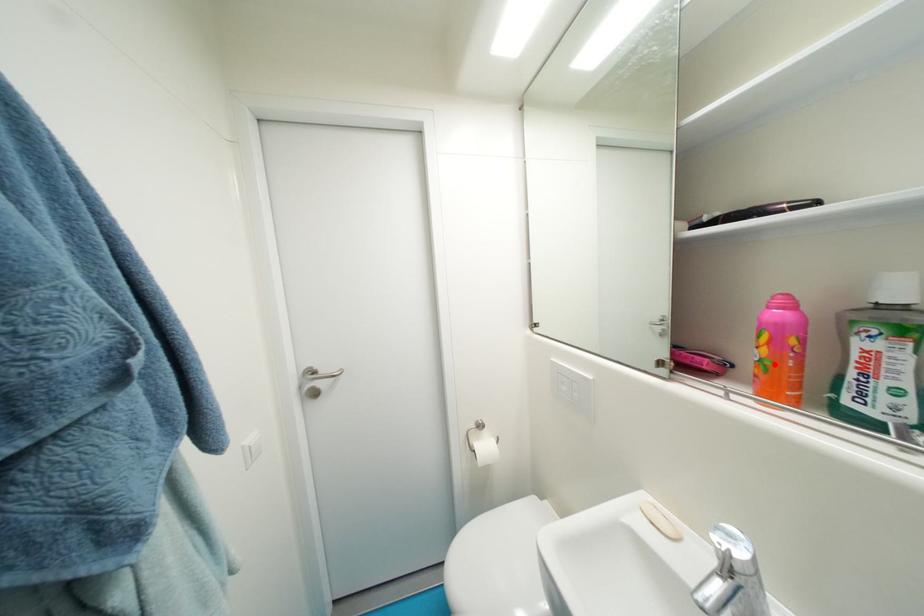
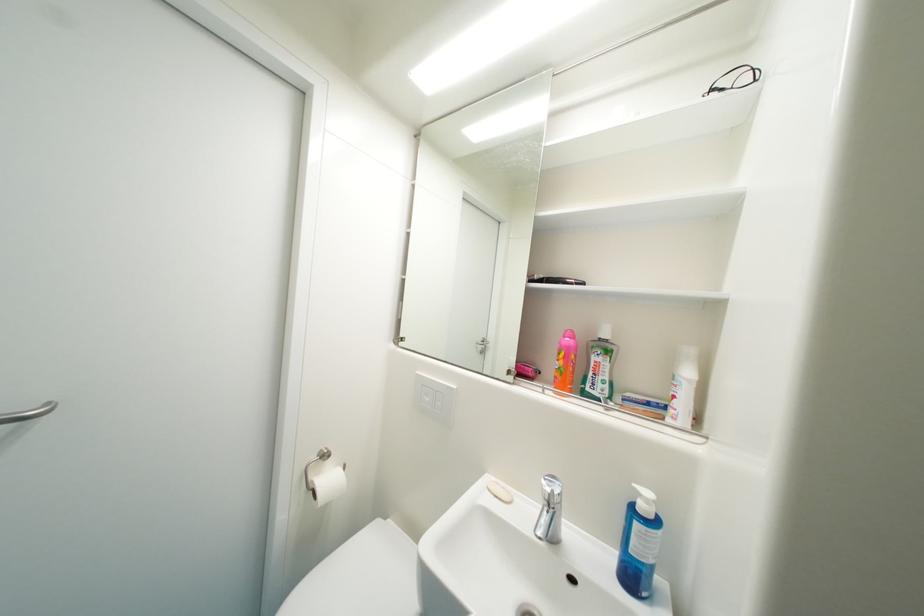
In the second image, find the point that corresponds to the highlighted location in the first image.

(569, 371)